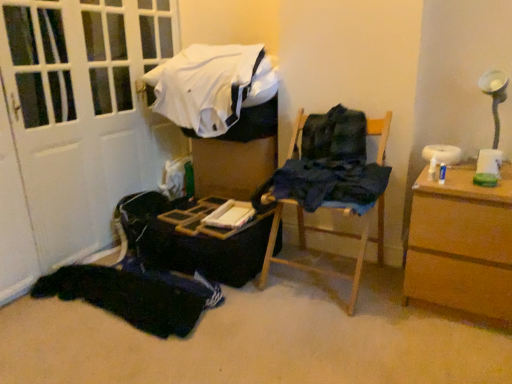
Find the location of `vacant space underneath wooden chair at center (from a real-world perspective)`. vacant space underneath wooden chair at center (from a real-world perspective) is located at coordinates (333, 276).